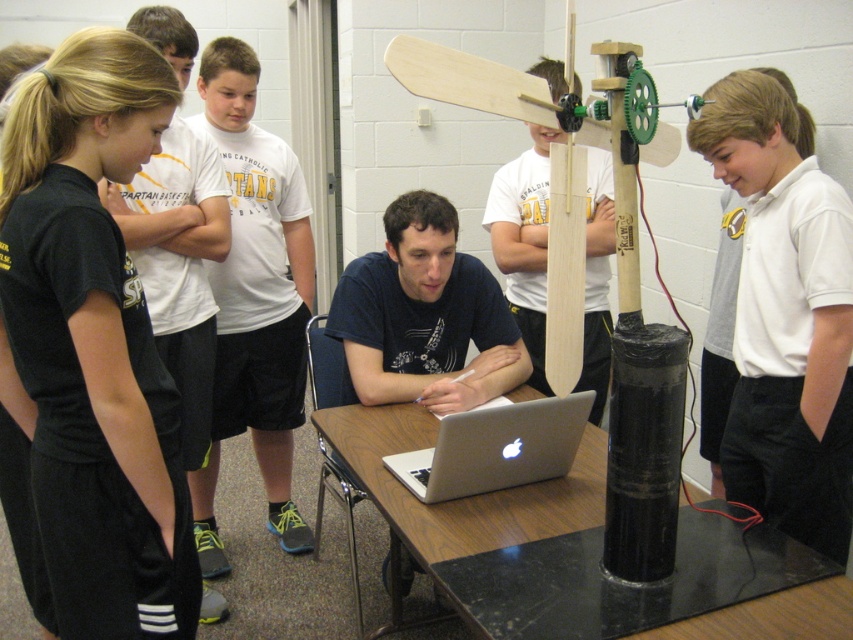
Question: Is wooden propeller at center below silver metallic laptop at center?

Choices:
 (A) yes
 (B) no

Answer: (B)

Question: Does white smooth shirt at upper right have a larger size compared to wooden propeller at center?

Choices:
 (A) yes
 (B) no

Answer: (B)

Question: Which object is farther from the camera taking this photo?

Choices:
 (A) silver metallic laptop at center
 (B) white cotton shirt at upper left
 (C) wooden propeller at center
 (D) dark blue shirt at center

Answer: (B)

Question: Which object is farther from the camera taking this photo?

Choices:
 (A) white smooth shirt at upper right
 (B) wooden propeller at center
 (C) dark blue shirt at center

Answer: (B)

Question: Which of these objects is positioned closest to the black fabric at left?

Choices:
 (A) black marble table at center
 (B) wooden propeller at center
 (C) white smooth shirt at upper right

Answer: (A)

Question: Where is black fabric at left located in relation to black marble table at center in the image?

Choices:
 (A) below
 (B) above

Answer: (B)